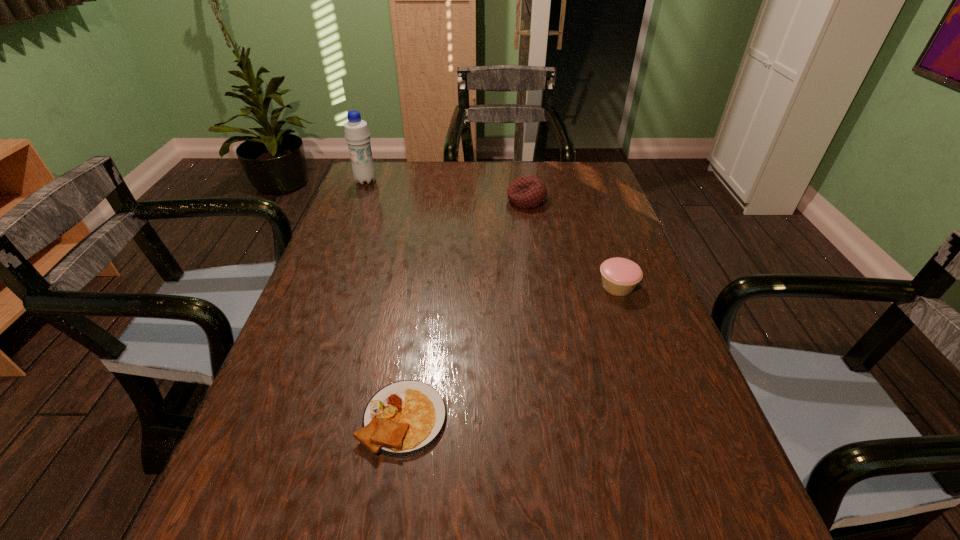
Find the location of a particular element. blank space located 0.070m on the left of the cupcake is located at coordinates (568, 286).

Locate an element on the screen. This screenshot has height=540, width=960. vacant region located on the right of the nearest object is located at coordinates (562, 418).

You are a GUI agent. You are given a task and a screenshot of the screen. Output one action in this format:
    pyautogui.click(x=<x>, y=<y>)
    Task: Click on the water bottle located at the far edge
    
    Given the screenshot: What is the action you would take?
    pyautogui.click(x=357, y=135)

Locate an element on the screen. beanbag positioned at the far edge is located at coordinates (526, 192).

This screenshot has width=960, height=540. I want to click on object present at the left edge, so click(357, 135).

At what (x,y) coordinates should I click in order to perform the action: click on object that is at the right edge. Please return your answer as a coordinate pair (x, y). Looking at the image, I should click on (620, 276).

What are the coordinates of `object located at the far left corner` in the screenshot? It's located at (357, 135).

Find the location of `free spot at the far edge of the desktop`. free spot at the far edge of the desktop is located at coordinates [552, 171].

In the image, there is a desktop. Where is `free region at the left edge`? free region at the left edge is located at coordinates (235, 469).

Locate an element on the screen. free region at the right edge of the desktop is located at coordinates (618, 418).